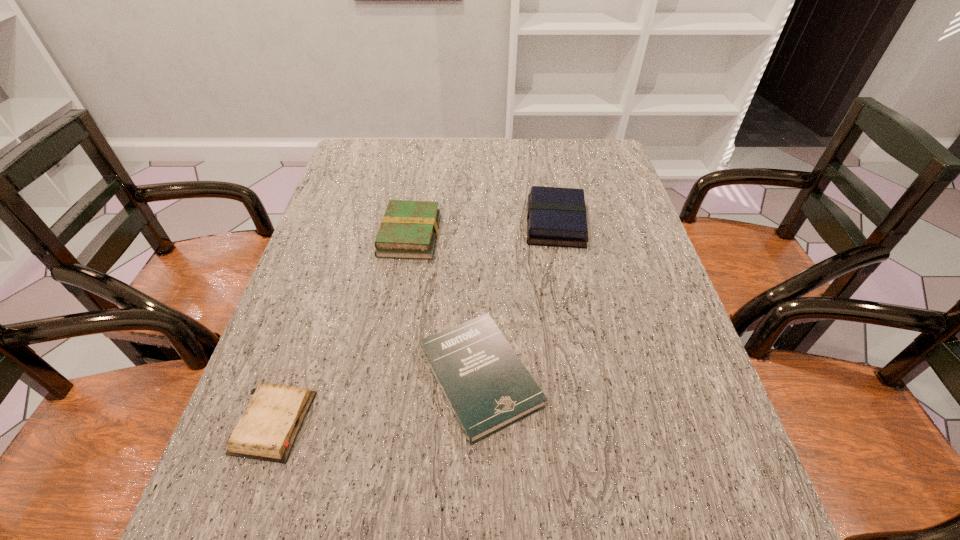
You are a GUI agent. You are given a task and a screenshot of the screen. Output one action in this format:
    pyautogui.click(x=<x>, y=<y>)
    Task: Click on the vacant space at the left edge of the desktop
    
    Given the screenshot: What is the action you would take?
    pyautogui.click(x=366, y=233)

In the image, there is a desktop. Where is `vacant area at the right edge`? The image size is (960, 540). vacant area at the right edge is located at coordinates (606, 255).

Locate an element on the screen. blank space at the far left corner of the desktop is located at coordinates (362, 150).

I want to click on vacant space at the far right corner of the desktop, so click(x=602, y=159).

Where is `free spot between the nearest book and the shortest object`? free spot between the nearest book and the shortest object is located at coordinates (377, 400).

Identify which object is the third closest to the third tallest object. Please provide its 2D coordinates. Your answer should be formatted as a tuple, i.e. [(x, y)], where the tuple contains the x and y coordinates of a point satisfying the conditions above.

[(556, 217)]

Identify which object is the third closest to the leftmost object. Please provide its 2D coordinates. Your answer should be formatted as a tuple, i.e. [(x, y)], where the tuple contains the x and y coordinates of a point satisfying the conditions above.

[(556, 217)]

The width and height of the screenshot is (960, 540). What are the coordinates of `the second closest book to the shortest object` in the screenshot? It's located at (409, 229).

The height and width of the screenshot is (540, 960). I want to click on book that stands as the closest to the second shortest object, so click(x=409, y=229).